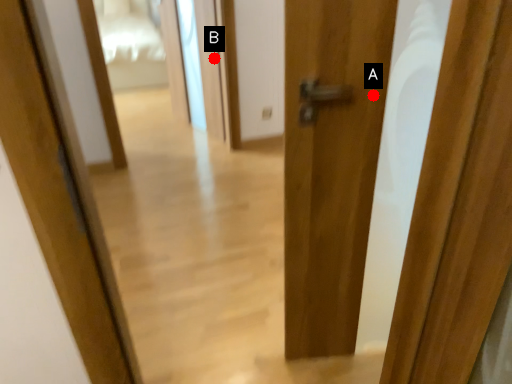
Question: Two points are circled on the image, labeled by A and B beside each circle. Which point is further to the camera?

Choices:
 (A) A is further
 (B) B is further

Answer: (B)